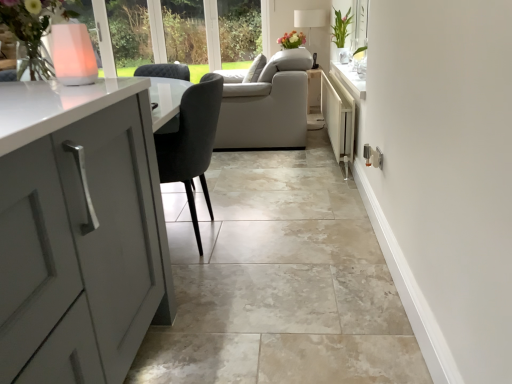
What are the coordinates of `white fabric lampshade at upper center` in the screenshot? It's located at (309, 19).

The width and height of the screenshot is (512, 384). Find the location of `pink translucent vase at upper left`. pink translucent vase at upper left is located at coordinates (73, 54).

What is the approximate width of beige marble tile at center?

beige marble tile at center is 4.02 meters wide.

Locate an element on the screen. white fabric lampshade at upper center is located at coordinates (309, 19).

Is point (82, 42) in front of point (291, 31)?

That is True.

In order to click on vase in front of the matte pink flowers at upper center in this screenshot , I will do `click(73, 54)`.

How far apart are pink translucent vase at upper left and matte pink flowers at upper center?

They are 3.40 meters apart.

From the image's perspective, is pink translucent vase at upper left beneath matte pink flowers at upper center?

Correct, pink translucent vase at upper left appears lower than matte pink flowers at upper center in the image.

Could you tell me if beige marble tile at center is turned towards white metallic radiator at center-right?

No, beige marble tile at center is not oriented towards white metallic radiator at center-right.

Based on the photo, can you confirm if beige marble tile at center is positioned to the left of white metallic radiator at center-right?

Yes.

From a real-world perspective, does beige marble tile at center sit lower than white metallic radiator at center-right?

Yes.

What's the angular difference between beige marble tile at center and white metallic radiator at center-right's facing directions?

88.3 degrees.

Considering their positions, is matte pink flowers at upper center located in front of or behind pink translucent vase at upper left?

Clearly, matte pink flowers at upper center is behind pink translucent vase at upper left.

Can you tell me how much matte pink flowers at upper center and pink translucent vase at upper left differ in facing direction?

They differ by 89.4 degrees in their facing directions.

From a real-world perspective, between matte pink flowers at upper center and pink translucent vase at upper left, who is vertically higher?

From a 3D spatial view, pink translucent vase at upper left is above.

Is matte pink flowers at upper center at the right side of pink translucent vase at upper left?

Indeed, matte pink flowers at upper center is positioned on the right side of pink translucent vase at upper left.

Is white fabric lampshade at upper center facing towards pink translucent vase at upper left?

No, white fabric lampshade at upper center is not oriented towards pink translucent vase at upper left.

Identify the location of vase in front of the white fabric lampshade at upper center. The height and width of the screenshot is (384, 512). (73, 54).

In the scene shown: Would you say white fabric lampshade at upper center is a long distance from pink translucent vase at upper left?

Absolutely, white fabric lampshade at upper center is distant from pink translucent vase at upper left.

From a real-world perspective, who is located higher, white fabric lampshade at upper center or pink translucent vase at upper left?

pink translucent vase at upper left.

Relative to matte pink flowers at upper center, is white metallic radiator at center-right in front or behind?

Visually, white metallic radiator at center-right is located in front of matte pink flowers at upper center.

Is white metallic radiator at center-right located outside matte pink flowers at upper center?

Indeed, white metallic radiator at center-right is completely outside matte pink flowers at upper center.

Based on the photo, would you say white metallic radiator at center-right is a long distance from matte pink flowers at upper center?

Indeed, white metallic radiator at center-right is not near matte pink flowers at upper center.

Is white metallic radiator at center-right oriented away from matte pink flowers at upper center?

No.

How different are the orientations of white fabric lampshade at upper center and beige marble tile at center in degrees?

They differ by 89.9 degrees in their facing directions.

Considering the sizes of objects white fabric lampshade at upper center and beige marble tile at center in the image provided, who is wider, white fabric lampshade at upper center or beige marble tile at center?

beige marble tile at center is wider.

Locate an element on the screen. The image size is (512, 384). lamp behind the beige marble tile at center is located at coordinates (309, 19).

From their relative heights in the image, would you say white fabric lampshade at upper center is taller or shorter than beige marble tile at center?

white fabric lampshade at upper center is taller than beige marble tile at center.

Is white metallic radiator at center-right surrounding beige marble tile at center?

No, beige marble tile at center is not a part of white metallic radiator at center-right.

Looking at this image, from the image's perspective, between white metallic radiator at center-right and beige marble tile at center, which one is located above?

white metallic radiator at center-right appears higher in the image.

Which of these two, white metallic radiator at center-right or beige marble tile at center, is wider?

Wider between the two is beige marble tile at center.

Considering the relative sizes of white metallic radiator at center-right and beige marble tile at center in the image provided, is white metallic radiator at center-right bigger than beige marble tile at center?

Incorrect, white metallic radiator at center-right is not larger than beige marble tile at center.

Find the location of `vase above the matte pink flowers at upper center (from a real-world perspective)`. vase above the matte pink flowers at upper center (from a real-world perspective) is located at coordinates (73, 54).

Identify the location of appliance located above the beige marble tile at center (from the image's perspective). (338, 118).

Which object lies further to the anchor point white fabric lampshade at upper center, beige marble tile at center or white glossy vase at upper right?

beige marble tile at center lies further to white fabric lampshade at upper center than the other object.

When comparing their distances from matte pink flowers at upper center, does pink translucent vase at upper left or beige marble tile at center seem closer?

beige marble tile at center lies closer to matte pink flowers at upper center than the other object.

Consider the image. Considering their positions, is white fabric lampshade at upper center positioned closer to white metallic radiator at center-right than pink translucent vase at upper left?

Based on the image, white fabric lampshade at upper center appears to be nearer to white metallic radiator at center-right.

Looking at this image, based on their spatial positions, is white fabric lampshade at upper center or matte pink flowers at upper center closer to white metallic radiator at center-right?

Based on the image, matte pink flowers at upper center appears to be nearer to white metallic radiator at center-right.

Considering their positions, is matte pink flowers at upper center positioned closer to pink translucent vase at upper left than white metallic radiator at center-right?

Based on the image, white metallic radiator at center-right appears to be nearer to pink translucent vase at upper left.

Which object lies nearer to the anchor point white metallic radiator at center-right, pink translucent vase at upper left or beige marble tile at center?

The object closer to white metallic radiator at center-right is beige marble tile at center.

From the image, which object appears to be farther from pink translucent vase at upper left, matte pink flowers at upper center or white fabric lampshade at upper center?

white fabric lampshade at upper center is positioned further to the anchor pink translucent vase at upper left.

When comparing their distances from white fabric lampshade at upper center, does matte pink flowers at upper center or white metallic radiator at center-right seem closer?

matte pink flowers at upper center is closer to white fabric lampshade at upper center.

You are a GUI agent. You are given a task and a screenshot of the screen. Output one action in this format:
    pyautogui.click(x=<x>, y=<y>)
    Task: Click on the appliance between pink translucent vase at upper left and white fabric lampshade at upper center from front to back
    
    Given the screenshot: What is the action you would take?
    pyautogui.click(x=338, y=118)

Where is `flower between beige marble tile at center and white fabric lampshade at upper center along the z-axis`? The width and height of the screenshot is (512, 384). flower between beige marble tile at center and white fabric lampshade at upper center along the z-axis is located at coordinates tap(292, 40).

Where is `plant located between white metallic radiator at center-right and white fabric lampshade at upper center in the depth direction`? The height and width of the screenshot is (384, 512). plant located between white metallic radiator at center-right and white fabric lampshade at upper center in the depth direction is located at coordinates pyautogui.click(x=341, y=28).

You are a GUI agent. You are given a task and a screenshot of the screen. Output one action in this format:
    pyautogui.click(x=<x>, y=<y>)
    Task: Click on the flower between white glossy vase at upper right and white fabric lampshade at upper center along the z-axis
    
    Given the screenshot: What is the action you would take?
    pyautogui.click(x=292, y=40)